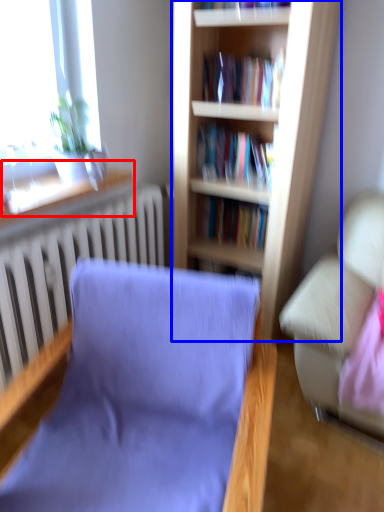
Question: Which object is further to the camera taking this photo, window sill (highlighted by a red box) or bookcase (highlighted by a blue box)?

Choices:
 (A) window sill
 (B) bookcase

Answer: (B)